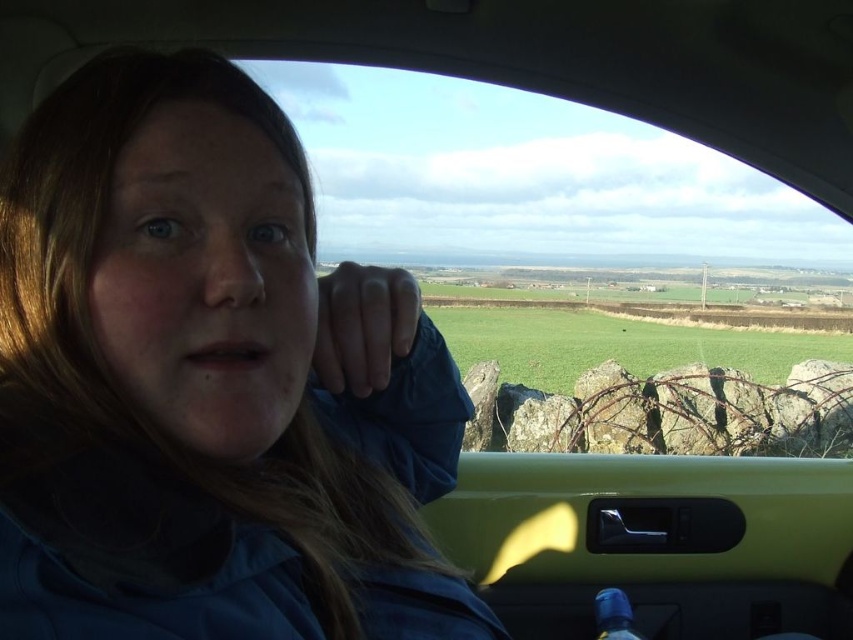
Identify the location of blue fabric at left. This screenshot has height=640, width=853. (207, 381).

Who is more distant from viewer, (167,248) or (606,627)?

The point (606,627) is behind.

Where is `blue fabric at left`? This screenshot has height=640, width=853. blue fabric at left is located at coordinates (207, 381).

At what (x,y) coordinates should I click in order to perform the action: click on blue fabric at left. Please return your answer as a coordinate pair (x, y). Image resolution: width=853 pixels, height=640 pixels. Looking at the image, I should click on (207, 381).